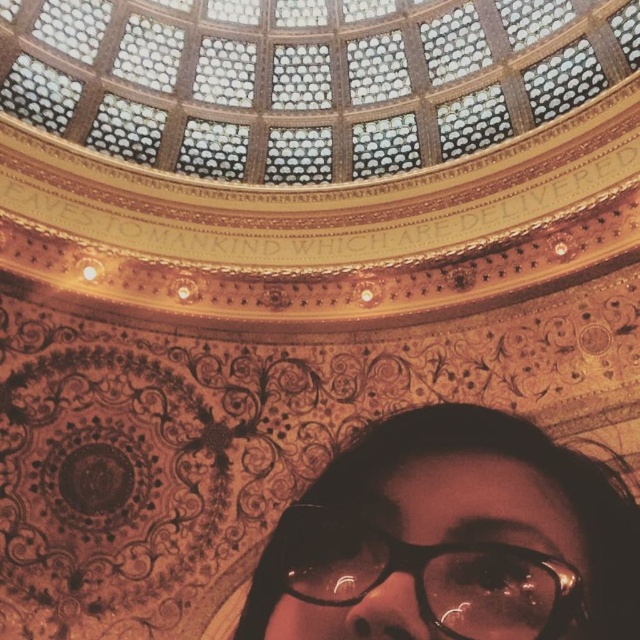
Question: Does matte black glasses at bottom appear on the right side of black plastic glasses at bottom?

Choices:
 (A) yes
 (B) no

Answer: (A)

Question: Which of the following is the closest to the observer?

Choices:
 (A) matte black glasses at bottom
 (B) black plastic glasses at bottom

Answer: (B)

Question: Does matte black glasses at bottom have a smaller size compared to black plastic glasses at bottom?

Choices:
 (A) yes
 (B) no

Answer: (B)

Question: Is matte black glasses at bottom bigger than black plastic glasses at bottom?

Choices:
 (A) no
 (B) yes

Answer: (B)